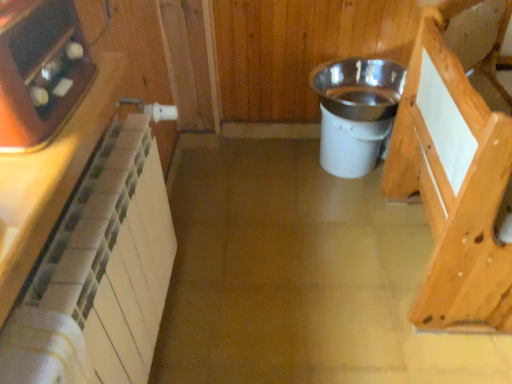
Where is `free spot to the left of white plastic bucket at center, the second appliance in the left-to-right sequence`? The image size is (512, 384). free spot to the left of white plastic bucket at center, the second appliance in the left-to-right sequence is located at coordinates (275, 169).